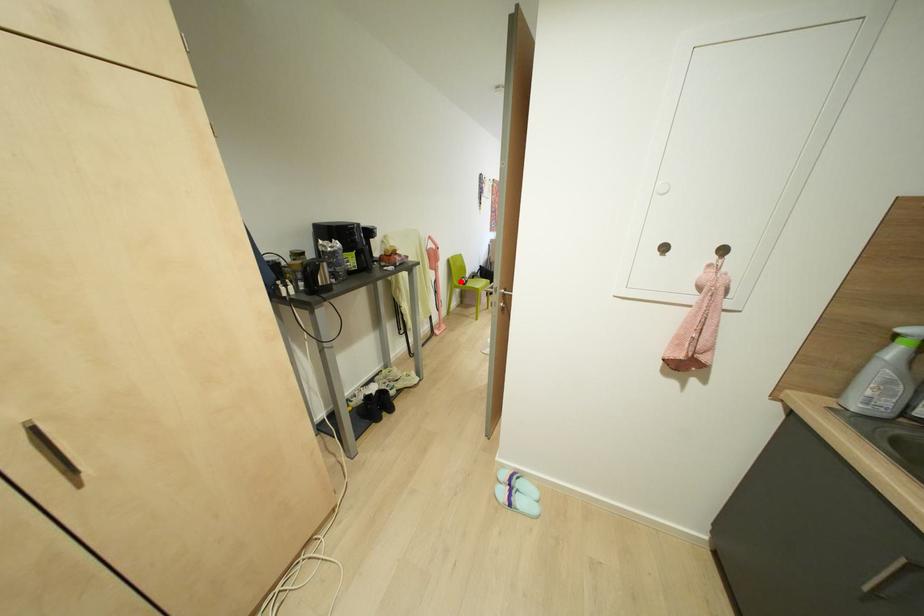
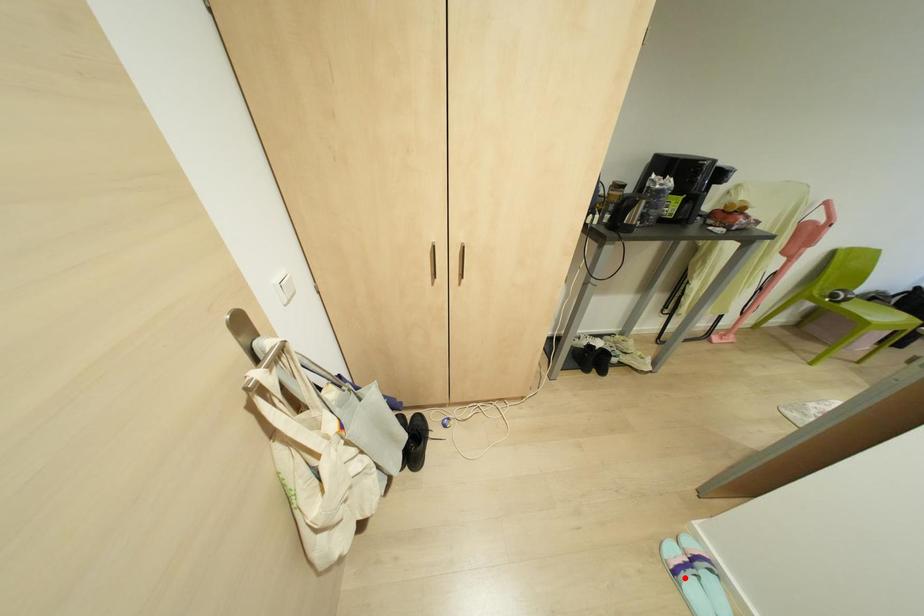
I am providing you with two images of the same scene from different viewpoints. A red point is marked on the first image and another point is marked on the second image. Is the red point in image1 aligned with the point shown in image2?

No